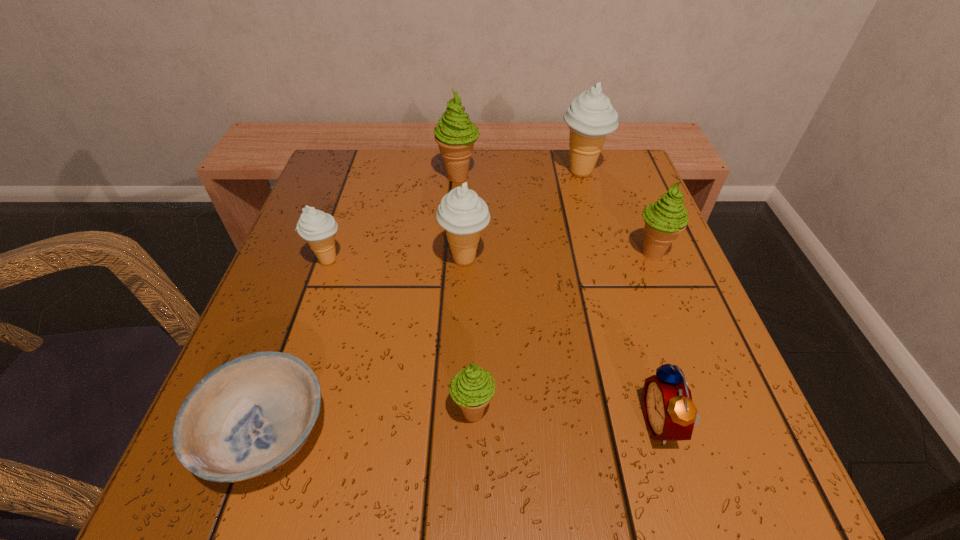
Where is `vacant space located 0.270m on the front-facing side of the alarm clock`? The height and width of the screenshot is (540, 960). vacant space located 0.270m on the front-facing side of the alarm clock is located at coordinates (450, 423).

Locate an element on the screen. vacant space located on the front-facing side of the alarm clock is located at coordinates (394, 423).

The height and width of the screenshot is (540, 960). In order to click on vacant space positioned 0.090m on the back of the blue bowl in this screenshot , I will do `click(303, 329)`.

I want to click on alarm clock at the near edge, so click(x=670, y=415).

I want to click on bowl present at the near edge, so click(247, 417).

Locate an element on the screen. icecream present at the left edge is located at coordinates (318, 228).

Image resolution: width=960 pixels, height=540 pixels. In order to click on bowl at the left edge in this screenshot , I will do `click(247, 417)`.

Where is `alarm clock that is at the right edge`? Image resolution: width=960 pixels, height=540 pixels. alarm clock that is at the right edge is located at coordinates (670, 415).

Find the location of a particular element. The image size is (960, 540). object located in the near left corner section of the desktop is located at coordinates (247, 417).

What are the coordinates of `object at the far right corner` in the screenshot? It's located at (590, 117).